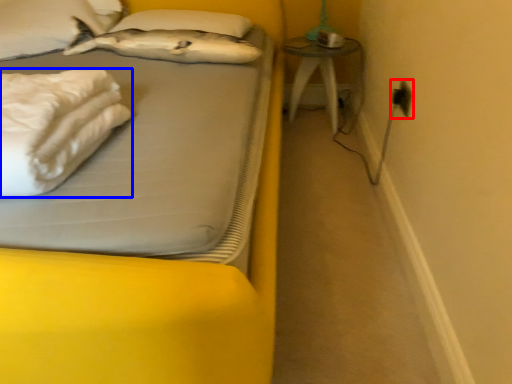
Question: Which point is further to the camera, electric outlet (highlighted by a red box) or material (highlighted by a blue box)?

Choices:
 (A) electric outlet
 (B) material

Answer: (A)